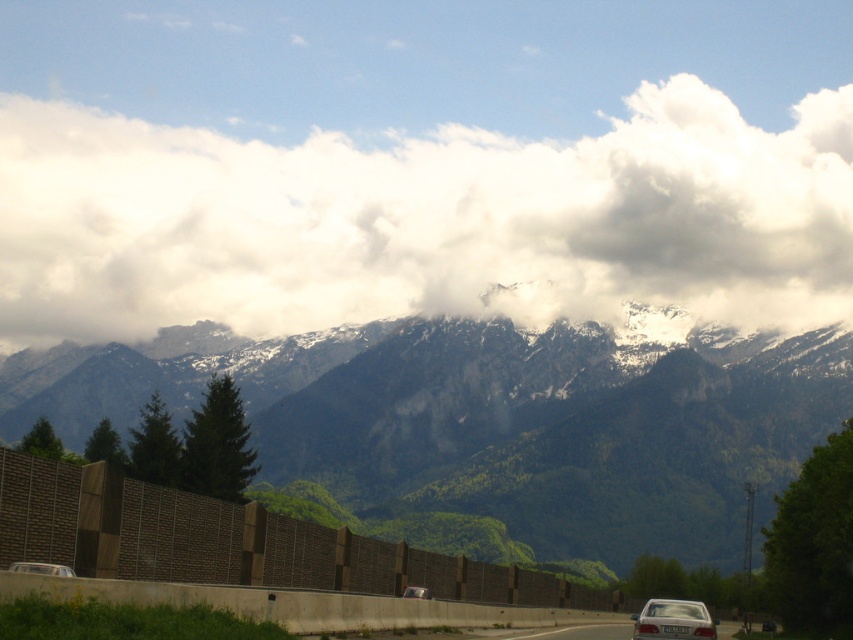
Question: Which object is closer to the camera taking this photo?

Choices:
 (A) white fluffy cloud at upper center
 (B) white glossy car at lower left
 (C) matte silver sedan at lower right

Answer: (B)

Question: Does snowy rock mountain range at center appear over metallic silver car at center?

Choices:
 (A) no
 (B) yes

Answer: (B)

Question: Which of these objects is positioned closest to the white fluffy cloud at upper center?

Choices:
 (A) matte silver sedan at lower right
 (B) snowy rock mountain range at center

Answer: (B)

Question: Is white glossy car at lower left above metallic silver car at center?

Choices:
 (A) no
 (B) yes

Answer: (B)

Question: Can you confirm if snowy rock mountain range at center is positioned to the right of matte silver sedan at lower right?

Choices:
 (A) no
 (B) yes

Answer: (A)

Question: Based on their relative distances, which object is nearer to the white glossy car at lower left?

Choices:
 (A) matte silver sedan at lower right
 (B) white fluffy cloud at upper center
 (C) metallic silver car at center

Answer: (A)